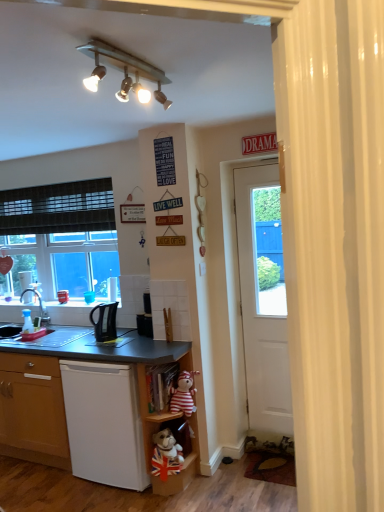
Question: Does matte black desk at lower left have a lesser height compared to brown textured rug at lower right?

Choices:
 (A) yes
 (B) no

Answer: (B)

Question: Is matte black desk at lower left not near brown textured rug at lower right?

Choices:
 (A) yes
 (B) no

Answer: (A)

Question: Is brown textured rug at lower right at the back of matte black desk at lower left?

Choices:
 (A) yes
 (B) no

Answer: (B)

Question: Considering the relative positions of matte black desk at lower left and brown textured rug at lower right in the image provided, is matte black desk at lower left to the right of brown textured rug at lower right from the viewer's perspective?

Choices:
 (A) yes
 (B) no

Answer: (B)

Question: Is matte black desk at lower left wider than brown textured rug at lower right?

Choices:
 (A) no
 (B) yes

Answer: (B)

Question: Is matte black desk at lower left to the left of brown textured rug at lower right from the viewer's perspective?

Choices:
 (A) yes
 (B) no

Answer: (A)

Question: Is metallic track lighting at upper center looking in the opposite direction of wooden shelf at lower center, acting as the 1th shelf starting from the bottom?

Choices:
 (A) no
 (B) yes

Answer: (A)

Question: Considering the relative sizes of metallic track lighting at upper center and wooden shelf at lower center, acting as the 1th shelf starting from the bottom, in the image provided, is metallic track lighting at upper center wider than wooden shelf at lower center, acting as the 1th shelf starting from the bottom,?

Choices:
 (A) no
 (B) yes

Answer: (A)

Question: Does metallic track lighting at upper center contain wooden shelf at lower center, acting as the 1th shelf starting from the bottom?

Choices:
 (A) yes
 (B) no

Answer: (B)

Question: Considering the relative positions of metallic track lighting at upper center and wooden shelf at lower center, the third shelf viewed from the top, in the image provided, is metallic track lighting at upper center to the right of wooden shelf at lower center, the third shelf viewed from the top, from the viewer's perspective?

Choices:
 (A) no
 (B) yes

Answer: (A)

Question: Is metallic track lighting at upper center facing towards wooden shelf at lower center, the third shelf viewed from the top?

Choices:
 (A) no
 (B) yes

Answer: (A)

Question: Is the depth of metallic track lighting at upper center greater than that of wooden shelf at lower center, acting as the 1th shelf starting from the bottom?

Choices:
 (A) yes
 (B) no

Answer: (B)

Question: Is striped fabric teddy bear at lower center taller than wooden shelf at lower center, the third shelf viewed from the top?

Choices:
 (A) no
 (B) yes

Answer: (A)